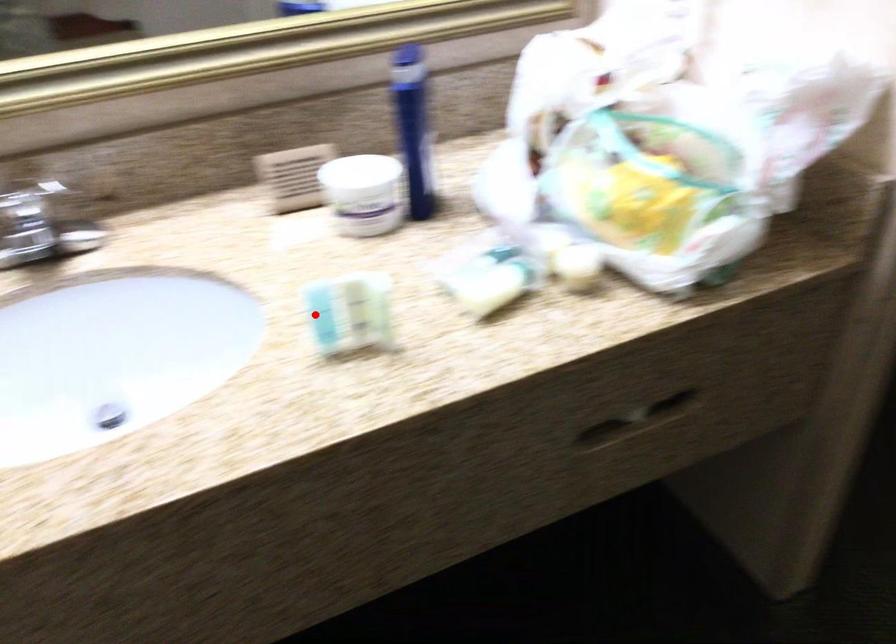
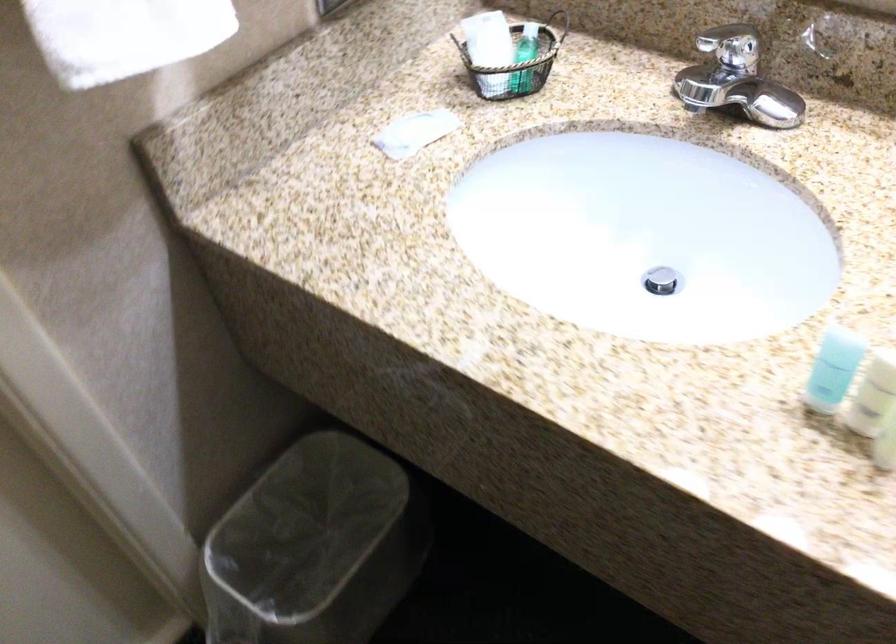
Find the pixel in the second image that matches the highlighted location in the first image.

(833, 368)